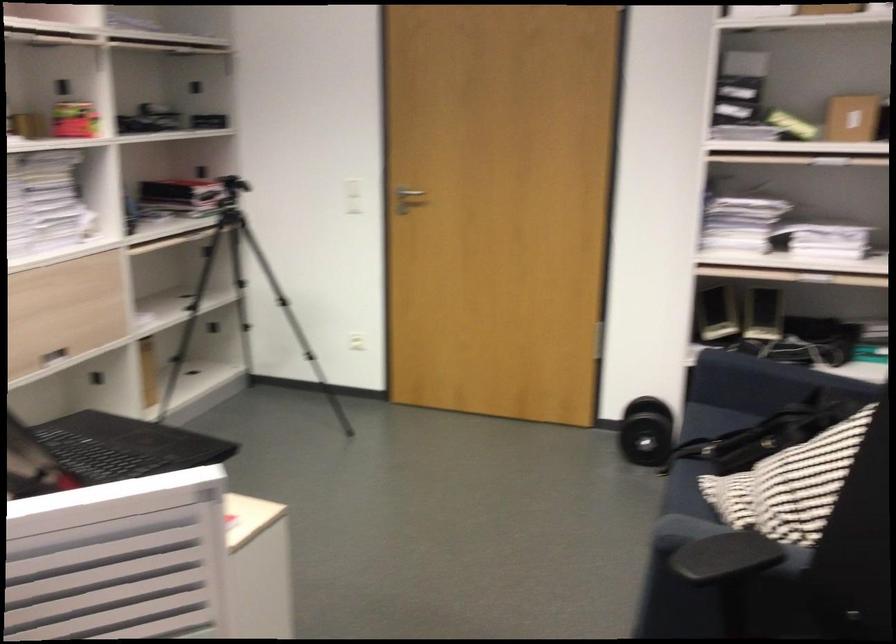
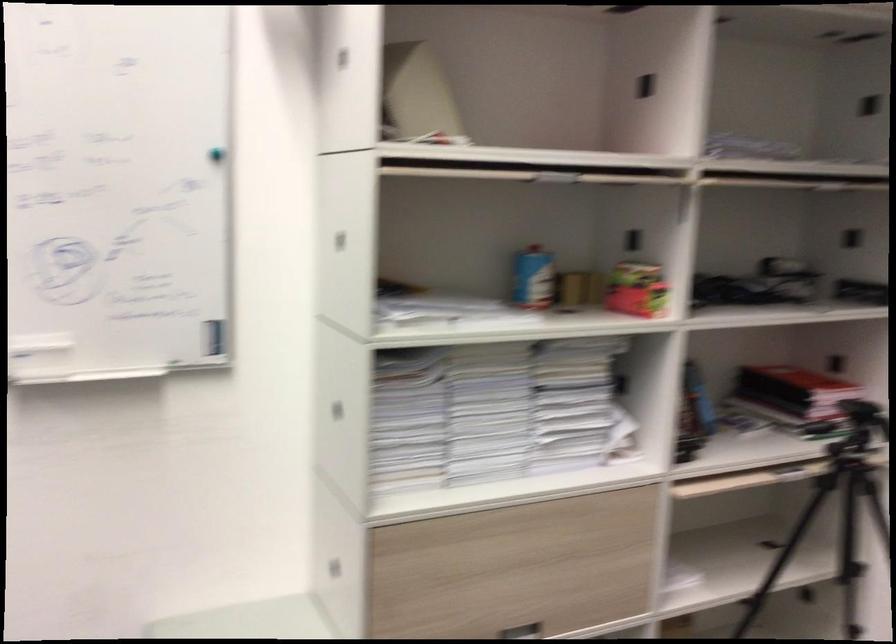
Find the pixel in the second image that matches the point at 79,120 in the first image.

(636, 289)